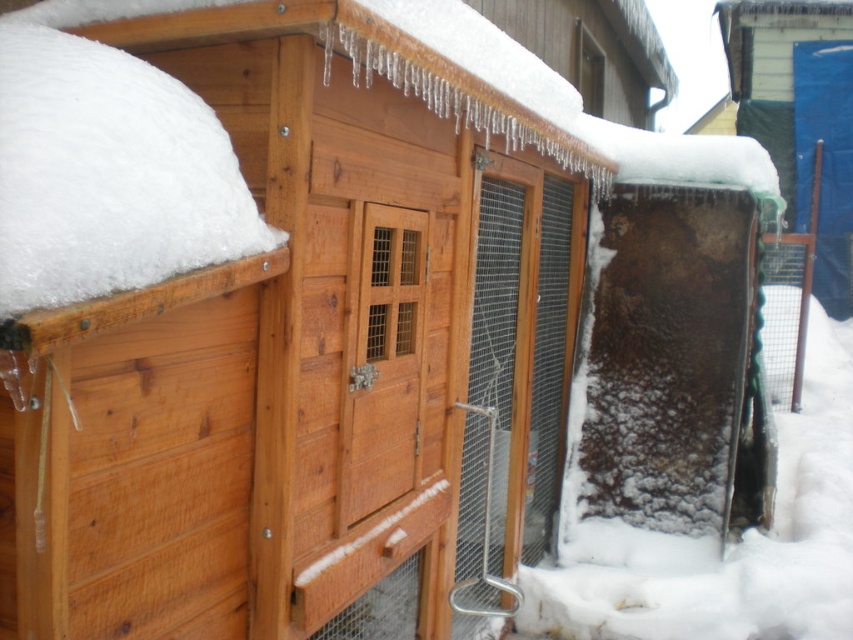
Who is positioned more to the left, frosted glass door at right or wooden screen door at center?

From the viewer's perspective, wooden screen door at center appears more on the left side.

Is frosted glass door at right further to camera compared to wooden screen door at center?

Yes, it is behind wooden screen door at center.

Describe the element at coordinates (717, 540) in the screenshot. I see `frosted glass door at right` at that location.

Where is `frosted glass door at right`? frosted glass door at right is located at coordinates (717, 540).

Can you confirm if white fluffy snow at upper left is wider than frosted glass door at right?

Indeed, white fluffy snow at upper left has a greater width compared to frosted glass door at right.

Find the location of `white fluffy snow at upper left`. white fluffy snow at upper left is located at coordinates (108, 173).

Is point (74, 301) positioned after point (619, 598)?

No, it is in front of (619, 598).

You are a GUI agent. You are given a task and a screenshot of the screen. Output one action in this format:
    pyautogui.click(x=<x>, y=<y>)
    Task: Click on the white fluffy snow at upper left
    
    Given the screenshot: What is the action you would take?
    pyautogui.click(x=108, y=173)

Can you confirm if white fluffy snow at upper left is shorter than wooden screen door at center?

Correct, white fluffy snow at upper left is not as tall as wooden screen door at center.

Who is more forward, (189, 176) or (351, 424)?

Point (189, 176)

What do you see at coordinates (108, 173) in the screenshot? Image resolution: width=853 pixels, height=640 pixels. I see `white fluffy snow at upper left` at bounding box center [108, 173].

At what (x,y) coordinates should I click in order to perform the action: click on white fluffy snow at upper left. Please return your answer as a coordinate pair (x, y). The height and width of the screenshot is (640, 853). Looking at the image, I should click on (108, 173).